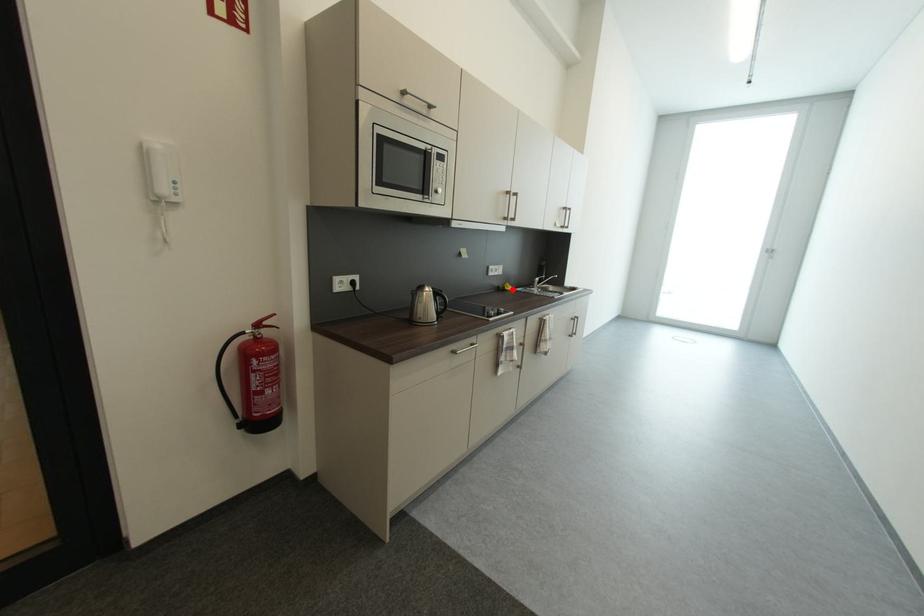
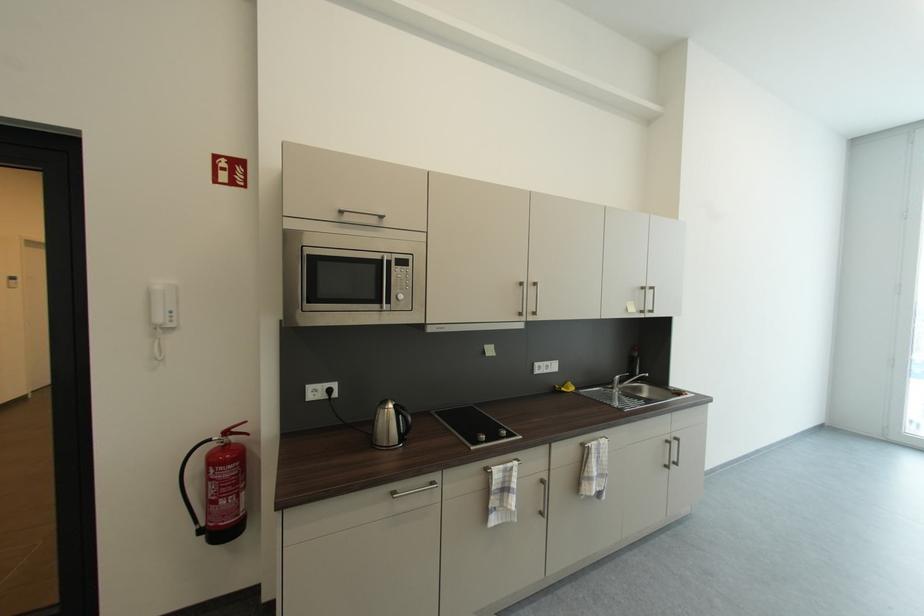
Locate, in the second image, the point that corresponds to the highlighted location in the first image.

(569, 391)